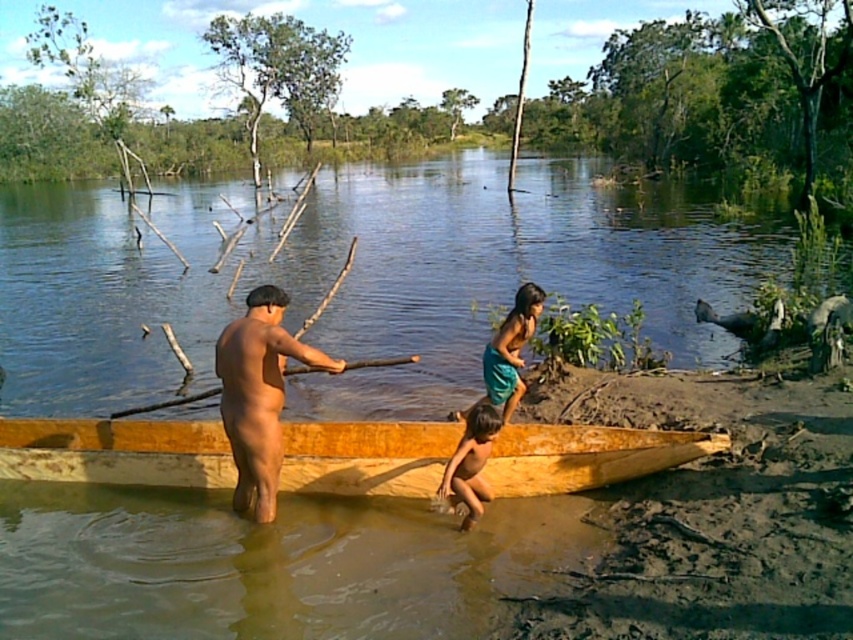
You are a photographer trying to capture the scene of the man and children near the canoe. You notice the teal fabric skirt at center and the wooden stick at center. Which object is covering the other one?

The teal fabric skirt at center is positioned over the wooden stick at center, so it is covering the wooden stick at center.